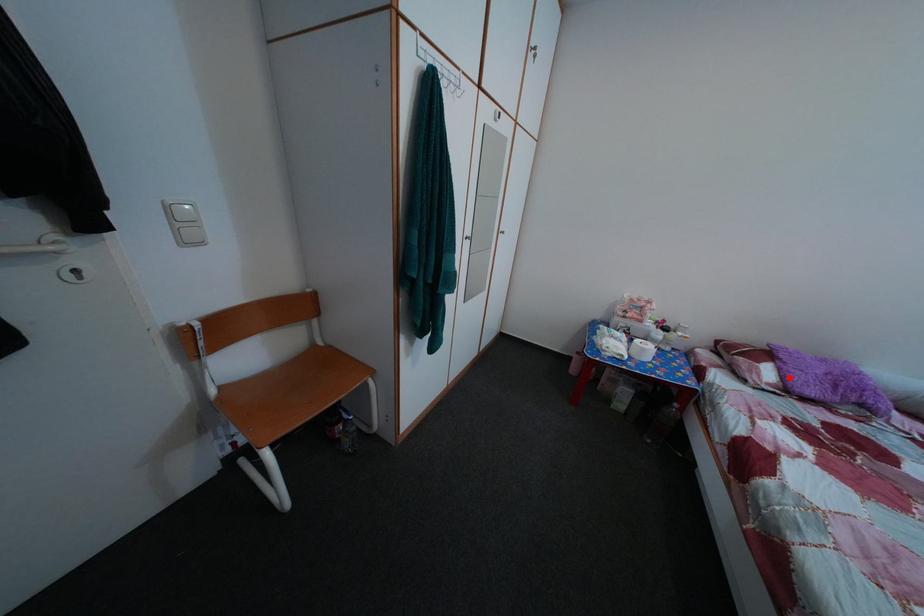
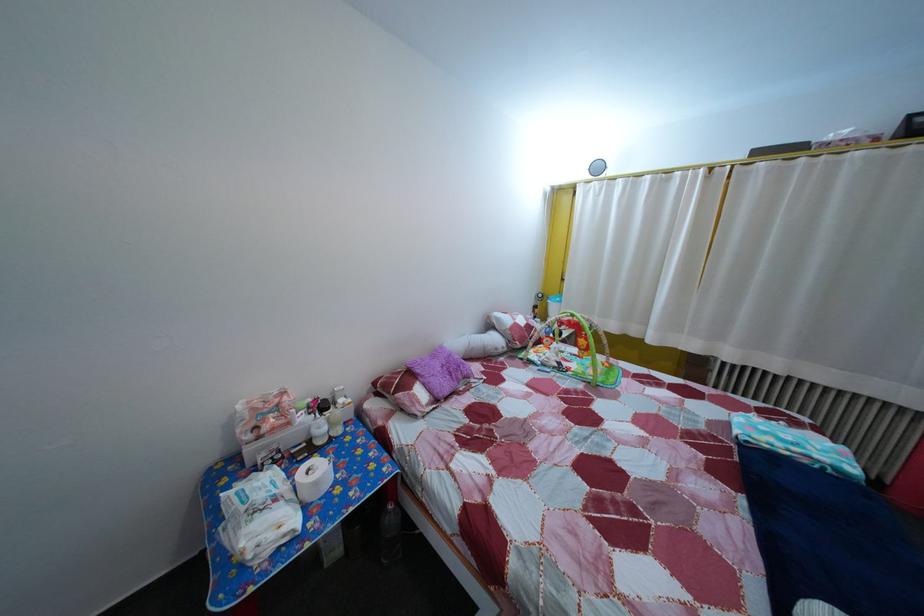
Locate, in the second image, the point that corresponds to the highlighted location in the first image.

(433, 392)